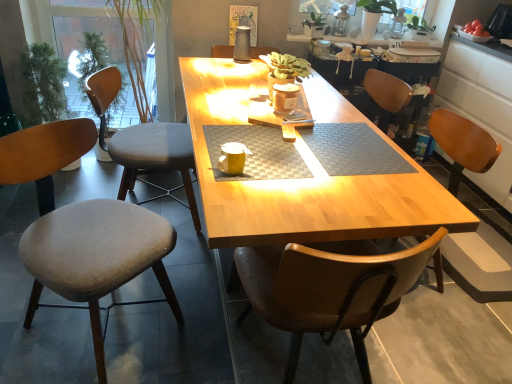
Question: Is gray fabric chair at left, arranged as the 2th chair when viewed from the right, completely or partially outside of wooden table at center?

Choices:
 (A) yes
 (B) no

Answer: (A)

Question: Considering the relative sizes of gray fabric chair at left, the second chair positioned from the left, and wooden table at center in the image provided, is gray fabric chair at left, the second chair positioned from the left, taller than wooden table at center?

Choices:
 (A) yes
 (B) no

Answer: (B)

Question: Is gray fabric chair at left, the second chair positioned from the left, closer to camera compared to wooden table at center?

Choices:
 (A) yes
 (B) no

Answer: (B)

Question: Can you confirm if gray fabric chair at left, arranged as the 2th chair when viewed from the right, is wider than wooden table at center?

Choices:
 (A) yes
 (B) no

Answer: (A)

Question: Can you see gray fabric chair at left, arranged as the 2th chair when viewed from the right, touching wooden table at center?

Choices:
 (A) no
 (B) yes

Answer: (A)

Question: Is wooden chair at right, which ranks as the 1th chair in right-to-left order, in front of or behind gray fabric chair at left, arranged as the 2th chair when viewed from the right, in the image?

Choices:
 (A) behind
 (B) front

Answer: (B)

Question: Considering the positions of wooden chair at right, which ranks as the 1th chair in right-to-left order, and gray fabric chair at left, arranged as the 2th chair when viewed from the right, in the image, is wooden chair at right, which ranks as the 1th chair in right-to-left order, taller or shorter than gray fabric chair at left, arranged as the 2th chair when viewed from the right,?

Choices:
 (A) short
 (B) tall

Answer: (B)

Question: From a real-world perspective, is wooden chair at right, the 3th chair in the left-to-right sequence, above or below gray fabric chair at left, the second chair positioned from the left?

Choices:
 (A) above
 (B) below

Answer: (A)

Question: Considering the positions of wooden chair at right, which ranks as the 1th chair in right-to-left order, and gray fabric chair at left, arranged as the 2th chair when viewed from the right, in the image, is wooden chair at right, which ranks as the 1th chair in right-to-left order, wider or thinner than gray fabric chair at left, arranged as the 2th chair when viewed from the right,?

Choices:
 (A) thin
 (B) wide

Answer: (B)

Question: Would you say velvet grey chair at left, the 1th chair in the left-to-right sequence, is to the left or to the right of yellow matte coffee cup at center in the picture?

Choices:
 (A) left
 (B) right

Answer: (A)

Question: Is point (121, 230) closer or farther from the camera than point (245, 150)?

Choices:
 (A) farther
 (B) closer

Answer: (A)

Question: From their relative heights in the image, would you say velvet grey chair at left, positioned as the third chair in right-to-left order, is taller or shorter than yellow matte coffee cup at center?

Choices:
 (A) tall
 (B) short

Answer: (A)

Question: Considering their positions, is velvet grey chair at left, positioned as the third chair in right-to-left order, located in front of or behind yellow matte coffee cup at center?

Choices:
 (A) behind
 (B) front

Answer: (B)

Question: Considering the positions of gray fabric chair at left, the second chair positioned from the left, and velvet grey chair at left, positioned as the third chair in right-to-left order, in the image, is gray fabric chair at left, the second chair positioned from the left, taller or shorter than velvet grey chair at left, positioned as the third chair in right-to-left order,?

Choices:
 (A) short
 (B) tall

Answer: (A)

Question: From a real-world perspective, is gray fabric chair at left, the second chair positioned from the left, positioned above or below velvet grey chair at left, the 1th chair in the left-to-right sequence?

Choices:
 (A) above
 (B) below

Answer: (B)